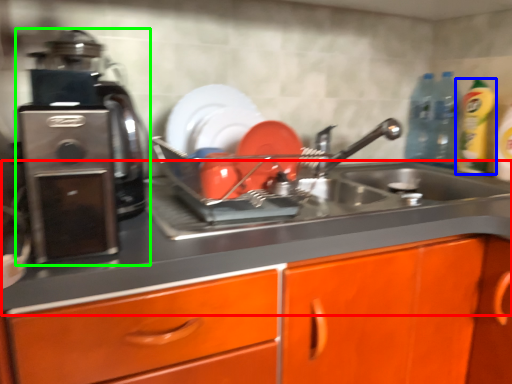
Question: Which object is positioned closest to counter top (highlighted by a red box)? Select from cleaning product (highlighted by a blue box) and home appliance (highlighted by a green box).

Choices:
 (A) cleaning product
 (B) home appliance

Answer: (B)